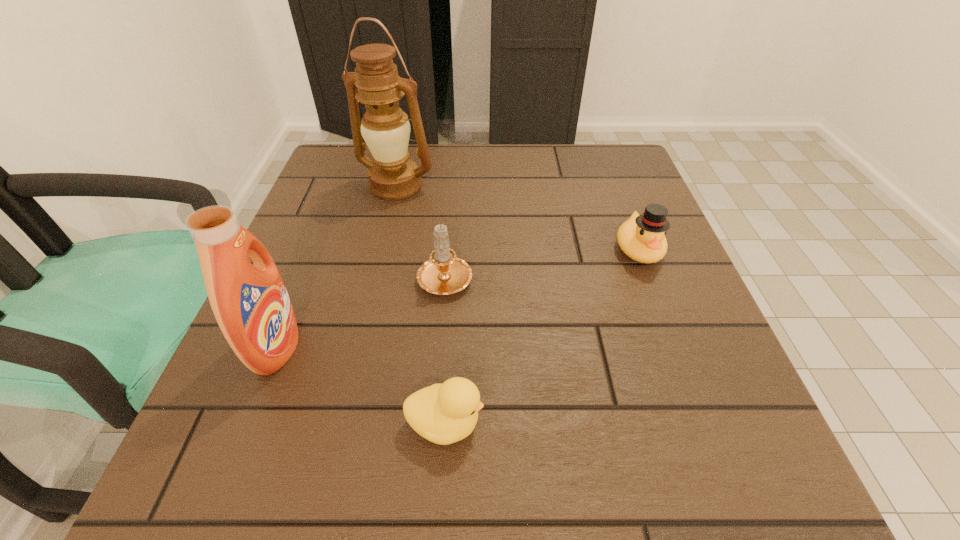
The width and height of the screenshot is (960, 540). Find the location of `empty space that is in between the tallest object and the fourth shortest object`. empty space that is in between the tallest object and the fourth shortest object is located at coordinates (337, 266).

I want to click on vacant area that lies between the tallest object and the fourth farthest object, so click(337, 266).

This screenshot has width=960, height=540. What are the coordinates of `free area in between the oil lamp and the nearest object` in the screenshot? It's located at (420, 305).

Image resolution: width=960 pixels, height=540 pixels. I want to click on free space that is in between the left duck and the candle, so click(x=445, y=350).

You are a GUI agent. You are given a task and a screenshot of the screen. Output one action in this format:
    pyautogui.click(x=<x>, y=<y>)
    Task: Click on the empty location between the fourth farthest object and the candle
    
    Given the screenshot: What is the action you would take?
    pyautogui.click(x=361, y=312)

Identify the location of vacant space that's between the shortest object and the candle. Image resolution: width=960 pixels, height=540 pixels. (445, 350).

Where is `free space between the candle and the rightmost object`? The width and height of the screenshot is (960, 540). free space between the candle and the rightmost object is located at coordinates (541, 263).

You are a GUI agent. You are given a task and a screenshot of the screen. Output one action in this format:
    pyautogui.click(x=<x>, y=<y>)
    Task: Click on the object that is the third nearest to the left duck
    The width and height of the screenshot is (960, 540).
    Given the screenshot: What is the action you would take?
    pyautogui.click(x=642, y=237)

Point out which object is positioned as the third nearest to the nearer duck. Please provide its 2D coordinates. Your answer should be formatted as a tuple, i.e. [(x, y)], where the tuple contains the x and y coordinates of a point satisfying the conditions above.

[(642, 237)]

At what (x,y) coordinates should I click in order to perform the action: click on free space that satisfies the following two spatial constraints: 1. on the front-facing side of the taller duck; 2. on the front-facing side of the detergent. Please return your answer as a coordinate pair (x, y). Image resolution: width=960 pixels, height=540 pixels. Looking at the image, I should click on (676, 347).